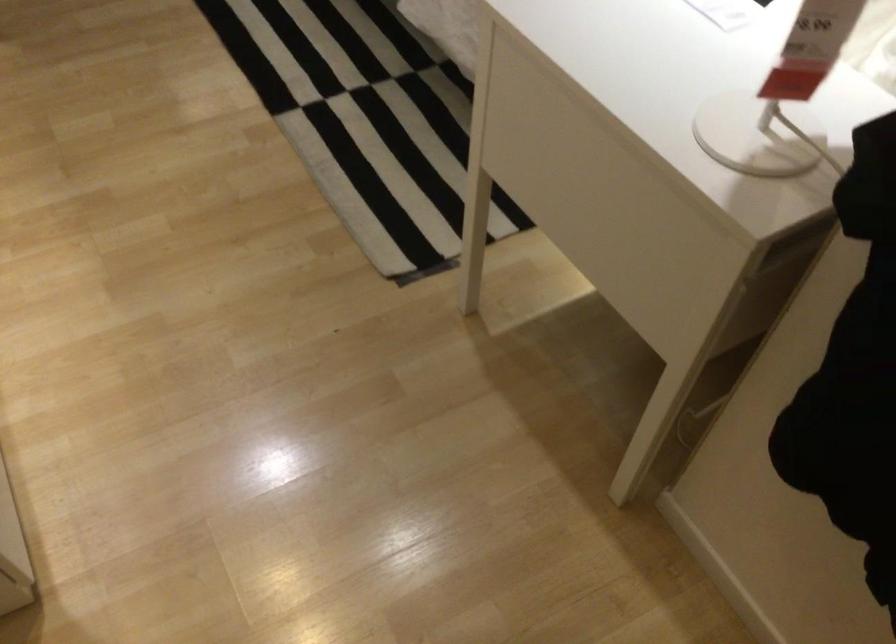
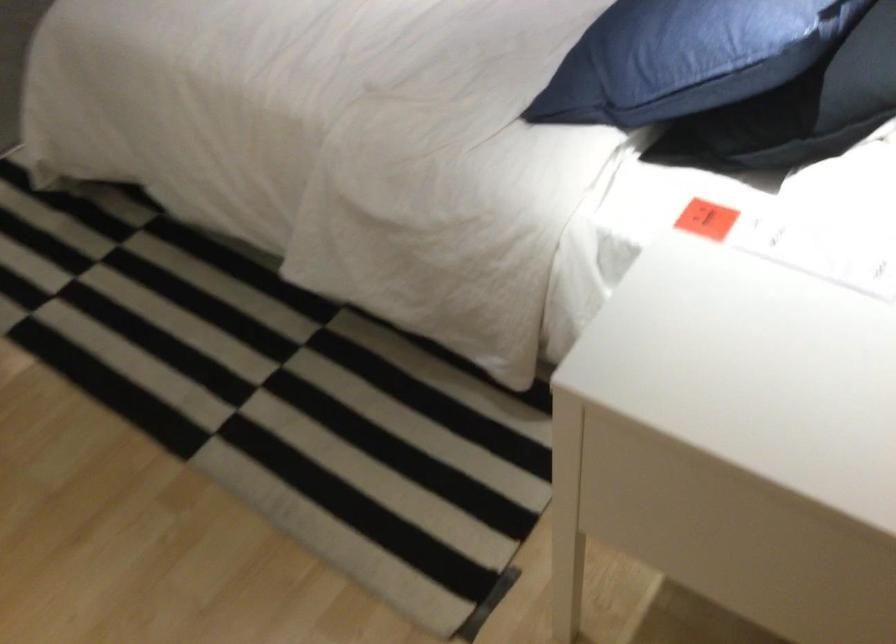
Question: Based on the continuous images, in which direction is the camera rotating? Reply with the corresponding letter.

Choices:
 (A) Left
 (B) Right
 (C) Up
 (D) Down

Answer: (B)